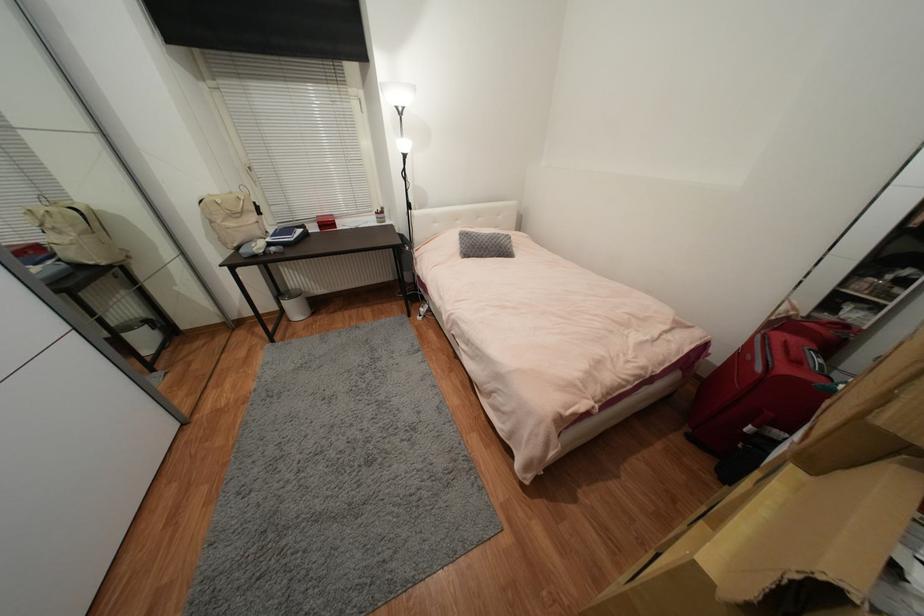
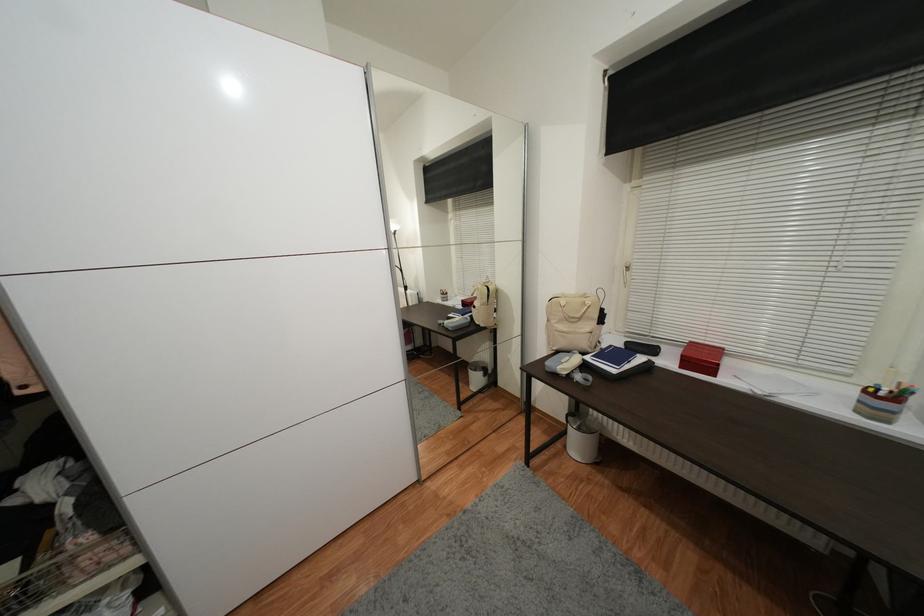
In the second image, find the point that corresponds to point 244,78 in the first image.

(678, 167)